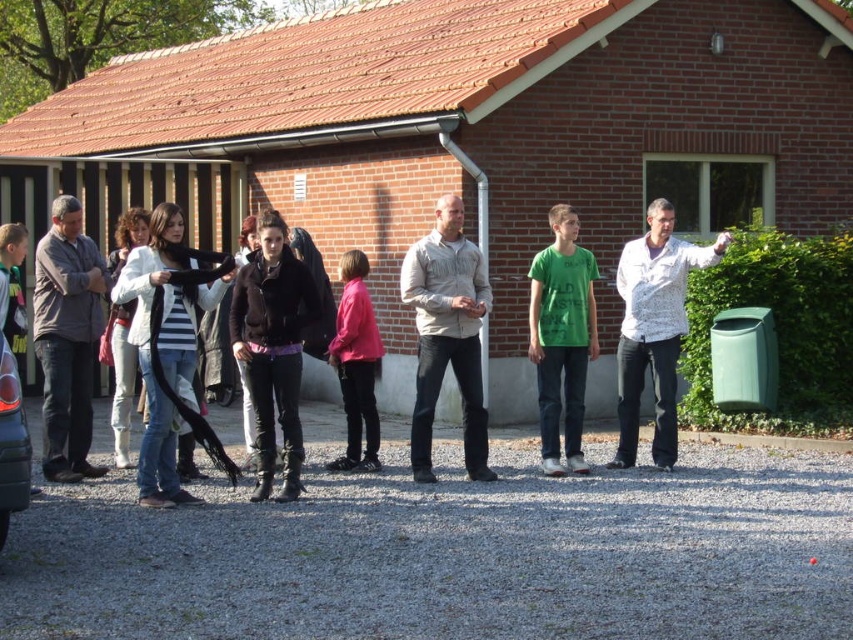
You are a photographer trying to capture a candid shot of the beige cotton shirt at center. You are currently positioned at point (447,333). Is the beige cotton shirt at center within your current field of view?

Yes, the beige cotton shirt at center is exactly at point (447,333), so it is directly in your current field of view.